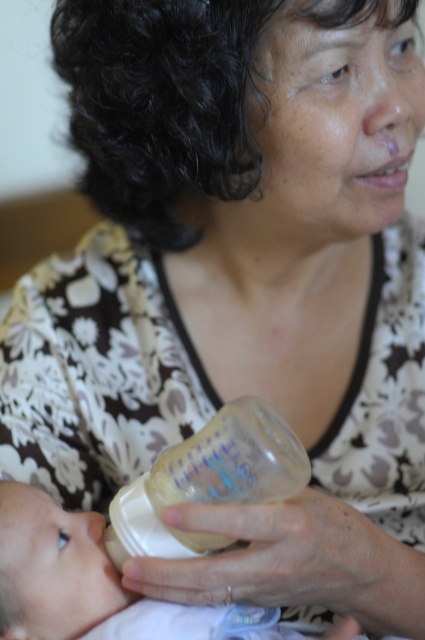
Question: Which point is farther from the camera taking this photo?

Choices:
 (A) (99, 572)
 (B) (169, 500)

Answer: (A)

Question: Which point appears closest to the camera in this image?

Choices:
 (A) (258, 476)
 (B) (87, 598)

Answer: (A)

Question: Considering the relative positions of transparent plastic bottle at center and smooth beige baby bottle at lower left in the image provided, where is transparent plastic bottle at center located with respect to smooth beige baby bottle at lower left?

Choices:
 (A) below
 (B) above

Answer: (B)

Question: Which point appears farthest from the camera in this image?

Choices:
 (A) (3, 525)
 (B) (172, 545)

Answer: (B)

Question: Is transparent plastic bottle at center to the left of smooth beige baby bottle at lower left from the viewer's perspective?

Choices:
 (A) yes
 (B) no

Answer: (B)

Question: Is transparent plastic bottle at center above smooth beige baby bottle at lower left?

Choices:
 (A) no
 (B) yes

Answer: (B)